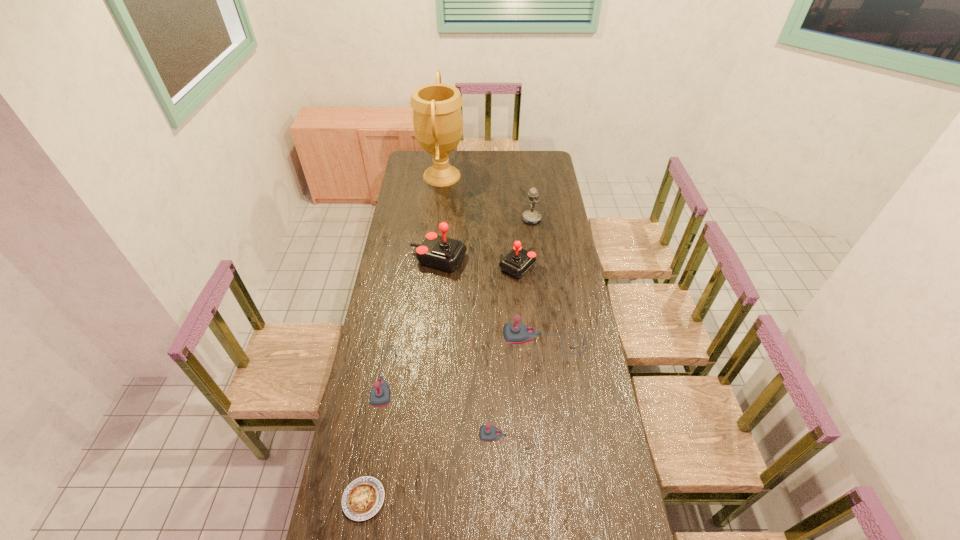
This screenshot has height=540, width=960. In order to click on object at the far left corner in this screenshot , I will do `click(437, 117)`.

This screenshot has width=960, height=540. I want to click on blank space at the far edge of the desktop, so click(481, 165).

Where is `vacant region at the left edge of the desktop`? Image resolution: width=960 pixels, height=540 pixels. vacant region at the left edge of the desktop is located at coordinates (374, 415).

Identify the location of vacant space at the right edge of the desktop. (572, 305).

This screenshot has width=960, height=540. I want to click on free region at the far left corner of the desktop, so click(426, 169).

This screenshot has height=540, width=960. Identify the location of empty location between the third tallest joystick and the bigger red joystick. (492, 300).

Image resolution: width=960 pixels, height=540 pixels. In order to click on vacant point located between the second nearest object and the third tallest joystick in this screenshot , I will do `click(454, 420)`.

The width and height of the screenshot is (960, 540). In order to click on vacant space in between the second shortest object and the right red joystick in this screenshot , I will do `click(441, 382)`.

This screenshot has width=960, height=540. Find the location of `free spot between the quiche and the fifth tallest object`. free spot between the quiche and the fifth tallest object is located at coordinates (454, 420).

At what (x,y) coordinates should I click in order to perform the action: click on empty location between the eighth tallest object and the fifth shortest object. Please return your answer as a coordinate pair (x, y). The height and width of the screenshot is (540, 960). Looking at the image, I should click on pos(454,420).